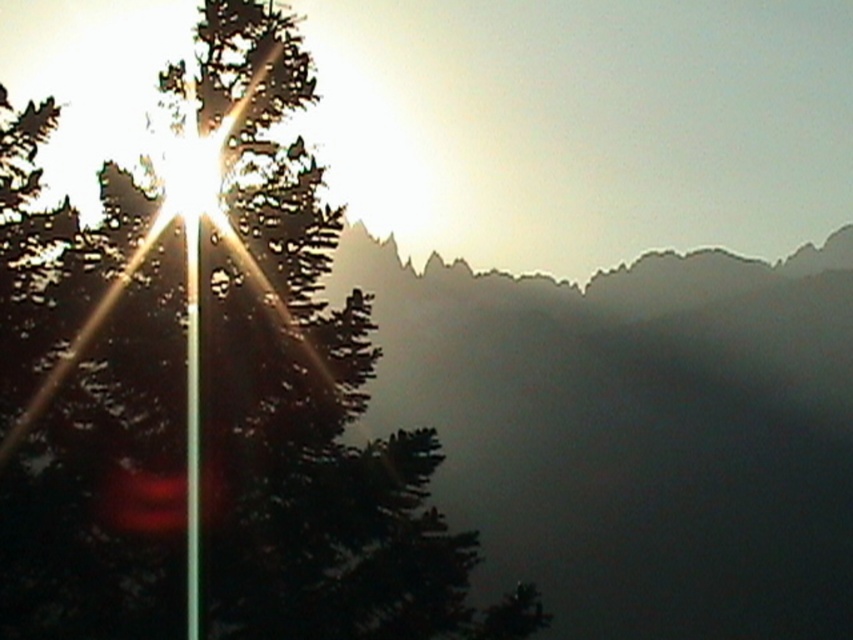
Question: Is green matte tree at upper left to the right of metallic pole at left from the viewer's perspective?

Choices:
 (A) yes
 (B) no

Answer: (B)

Question: Can you confirm if green matte tree at upper left is positioned above metallic pole at left?

Choices:
 (A) yes
 (B) no

Answer: (A)

Question: Which point is farther to the camera?

Choices:
 (A) (263, 86)
 (B) (193, 628)

Answer: (A)

Question: Does green matte tree at upper left have a smaller size compared to metallic pole at left?

Choices:
 (A) no
 (B) yes

Answer: (A)

Question: Among these objects, which one is nearest to the camera?

Choices:
 (A) green matte tree at upper left
 (B) metallic pole at left

Answer: (A)